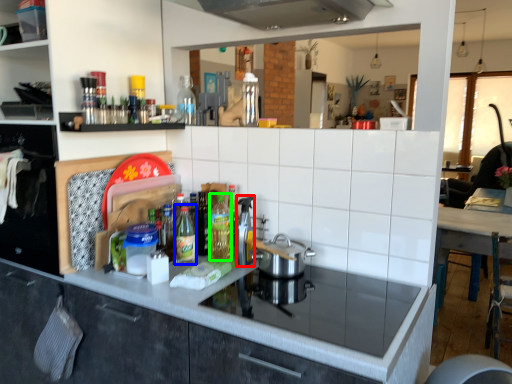
Question: Which is nearer to the appliance (highlighted by a red box)? bottle (highlighted by a blue box) or bottle (highlighted by a green box).

Choices:
 (A) bottle
 (B) bottle

Answer: (B)